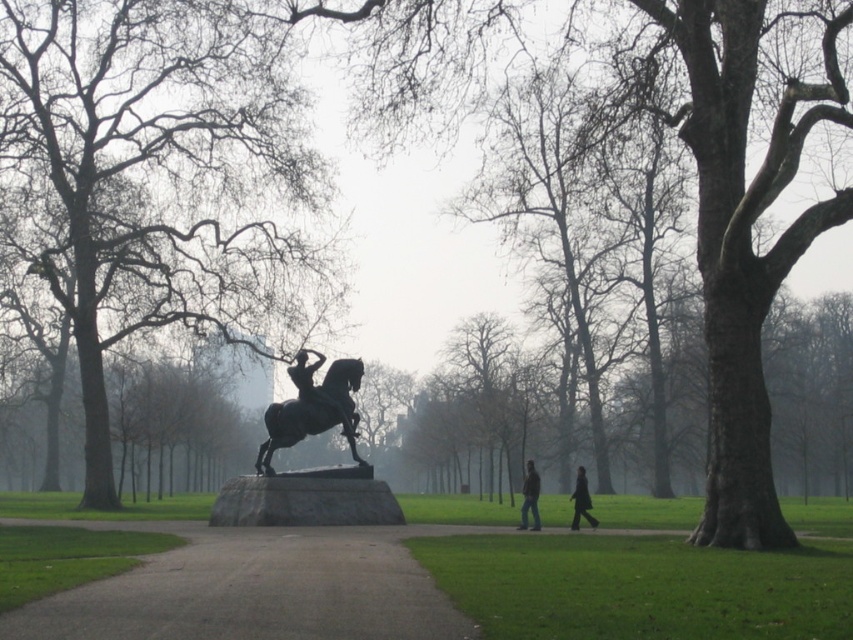
Can you confirm if dark gray jeans at center is wider than dark matte coat at lower right?

Indeed, dark gray jeans at center has a greater width compared to dark matte coat at lower right.

Can you confirm if dark gray jeans at center is bigger than dark matte coat at lower right?

Indeed, dark gray jeans at center has a larger size compared to dark matte coat at lower right.

Describe the element at coordinates (531, 497) in the screenshot. The image size is (853, 640). I see `dark gray jeans at center` at that location.

This screenshot has width=853, height=640. I want to click on dark gray jeans at center, so click(531, 497).

Measure the distance between smooth bark tree at center and polished bronze statue at center.

smooth bark tree at center is 68.90 feet from polished bronze statue at center.

This screenshot has width=853, height=640. Describe the element at coordinates (154, 176) in the screenshot. I see `smooth bark tree at center` at that location.

Image resolution: width=853 pixels, height=640 pixels. What are the coordinates of `smooth bark tree at center` in the screenshot? It's located at (154, 176).

Based on the photo, which is above, smooth concrete path at center or polished bronze statue at center?

Positioned higher is polished bronze statue at center.

Who is more distant from viewer, (149, 556) or (282, 484)?

The point (282, 484) is more distant.

Which is behind, point (268, 620) or point (270, 406)?

The point (270, 406) is more distant.

This screenshot has width=853, height=640. I want to click on smooth concrete path at center, so click(x=254, y=588).